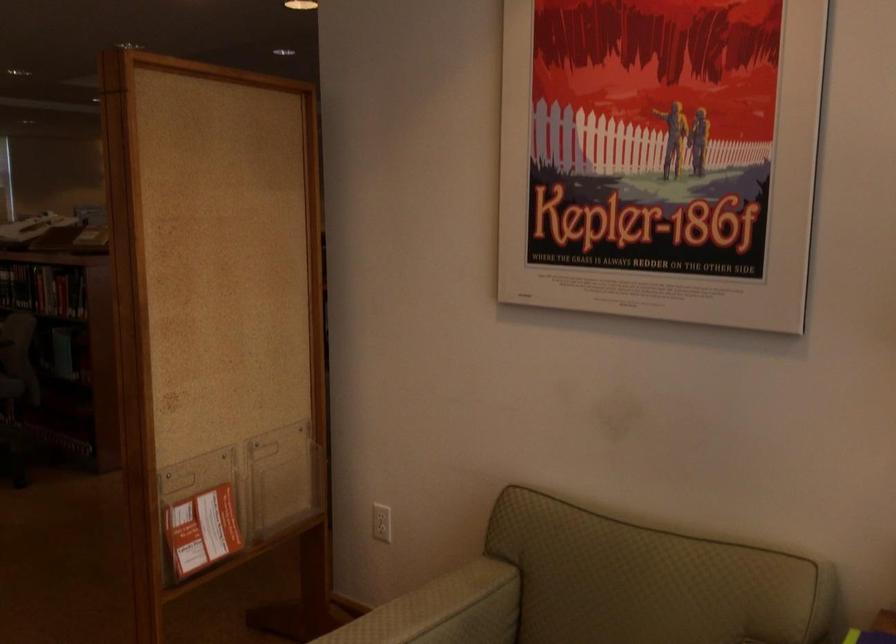
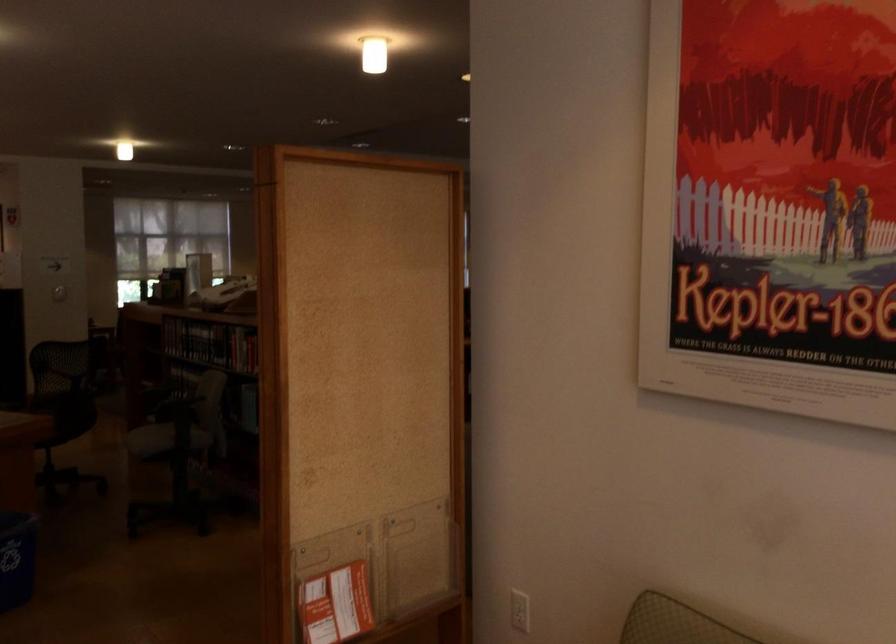
Find the pixel in the second image that matches (x=382, y=525) in the first image.

(520, 610)